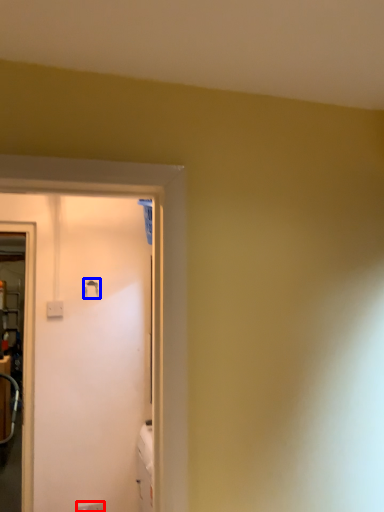
Question: Among these objects, which one is farthest to the camera, electric outlet (highlighted by a red box) or door handle (highlighted by a blue box)?

Choices:
 (A) electric outlet
 (B) door handle

Answer: (B)